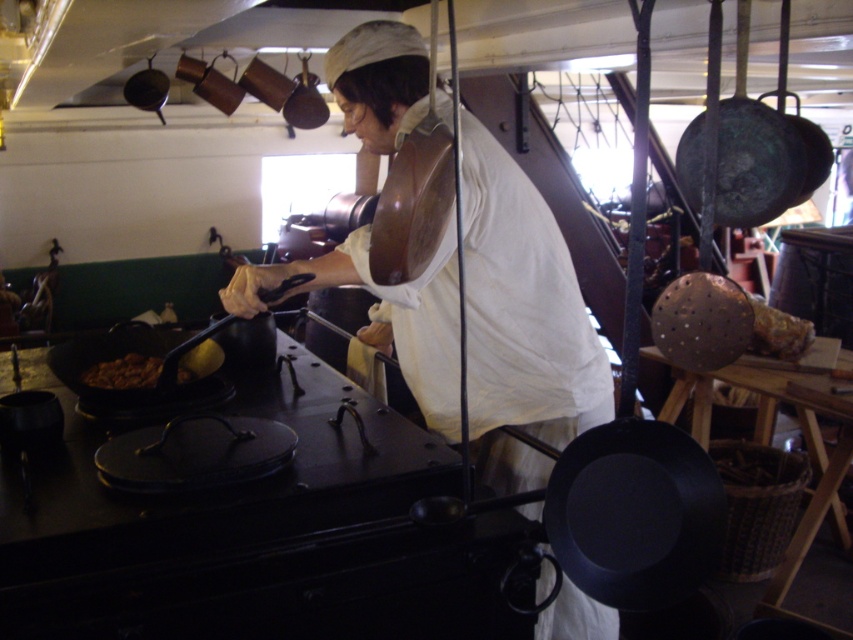
You are a guest in this historical kitchen and want to know which item is shorter. Which one is shorter between the brown matte food at center and the shiny copper frying pan at upper left?

The brown matte food at center is shorter than the shiny copper frying pan at upper left.

You are a visitor in this historical kitchen and want to take a closer look at the white matte apron at center and the black matte wok at left. Which object can you reach first without moving your position?

The white matte apron at center is closer to the viewer than the black matte wok at left, so you can reach the white matte apron at center first without moving your position.